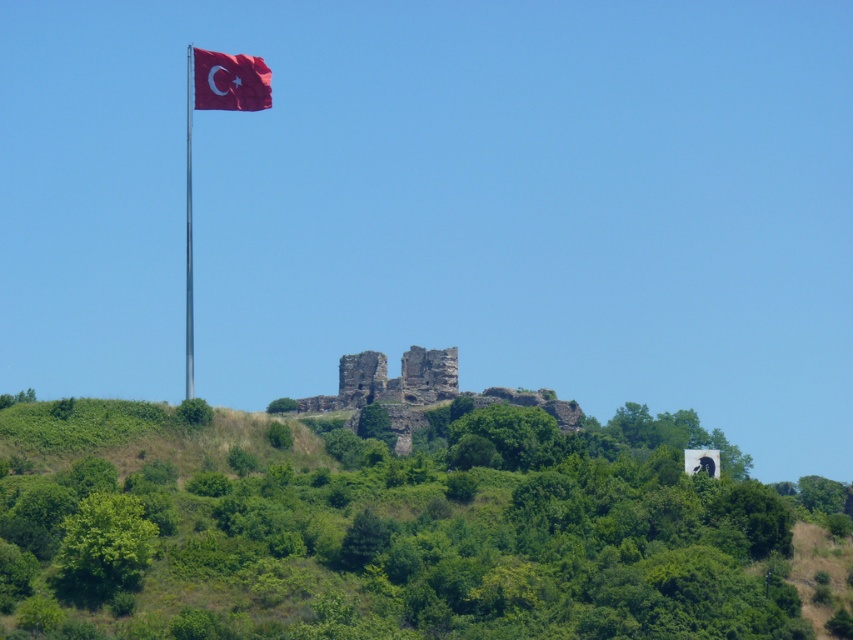
Question: Considering the real-world distances, which object is closest to the green leafy hillside at center?

Choices:
 (A) metallic flag pole at upper left
 (B) red fabric flag at upper left

Answer: (B)

Question: Does green leafy hillside at center appear on the left side of red fabric flag at upper left?

Choices:
 (A) yes
 (B) no

Answer: (B)

Question: Which point is farther to the camera?

Choices:
 (A) rustic stone castle at center
 (B) green leafy hillside at center
 (C) metallic flag pole at upper left
 (D) red fabric flag at upper left

Answer: (A)

Question: From the image, what is the correct spatial relationship of rustic stone castle at center in relation to metallic flag pole at upper left?

Choices:
 (A) right
 (B) left

Answer: (A)

Question: Based on their relative distances, which object is nearer to the green leafy hillside at center?

Choices:
 (A) metallic flag pole at upper left
 (B) rustic stone castle at center

Answer: (A)

Question: Does red fabric flag at upper left have a lesser width compared to metallic flag pole at upper left?

Choices:
 (A) no
 (B) yes

Answer: (B)